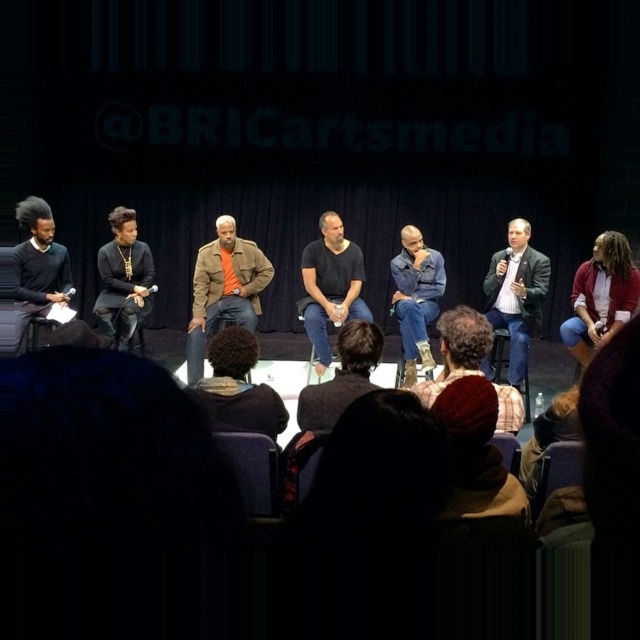
Question: Which point appears closest to the camera in this image?

Choices:
 (A) (433, 408)
 (B) (410, 300)
 (C) (29, 243)
 (D) (477, 314)

Answer: (A)

Question: Does denim jacket at lower right appear on the left side of dark gray suit at right?

Choices:
 (A) yes
 (B) no

Answer: (B)

Question: Does dark brown hair at lower center appear on the right side of brown knitted hat at center?

Choices:
 (A) no
 (B) yes

Answer: (A)

Question: Among these points, which one is nearest to the camera?

Choices:
 (A) (120, 234)
 (B) (244, 410)
 (C) (451, 316)
 (D) (509, 307)

Answer: (B)

Question: Does brown leather jacket at center appear on the left side of denim jeans at center?

Choices:
 (A) yes
 (B) no

Answer: (A)

Question: Among these points, which one is farthest from the camera?

Choices:
 (A) (470, 396)
 (B) (346, 268)
 (C) (228, 259)

Answer: (B)